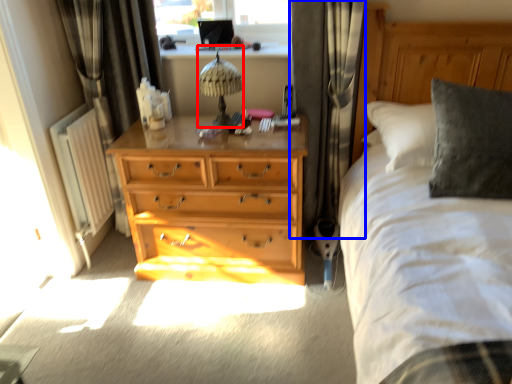
Question: Which of the following is the closest to the observer, table lamp (highlighted by a red box) or curtain (highlighted by a blue box)?

Choices:
 (A) table lamp
 (B) curtain

Answer: (B)